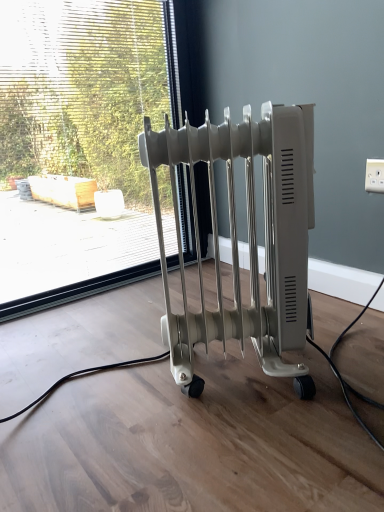
You are a GUI agent. You are given a task and a screenshot of the screen. Output one action in this format:
    pyautogui.click(x=<x>, y=<y>)
    Task: Click on the vacant region to the left of white plastic radiator at center
    
    Given the screenshot: What is the action you would take?
    pyautogui.click(x=110, y=395)